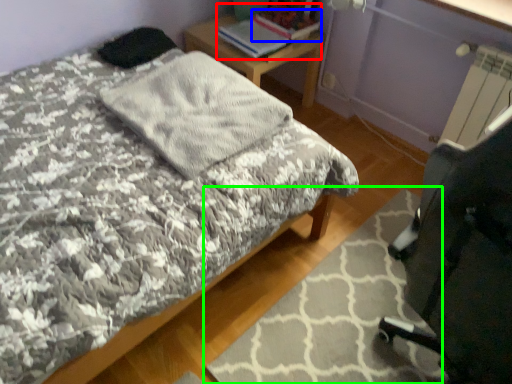
Question: Based on their relative distances, which object is nearer to book (highlighted by a red box)? Choose from book (highlighted by a blue box) and mat (highlighted by a green box).

Choices:
 (A) book
 (B) mat

Answer: (A)